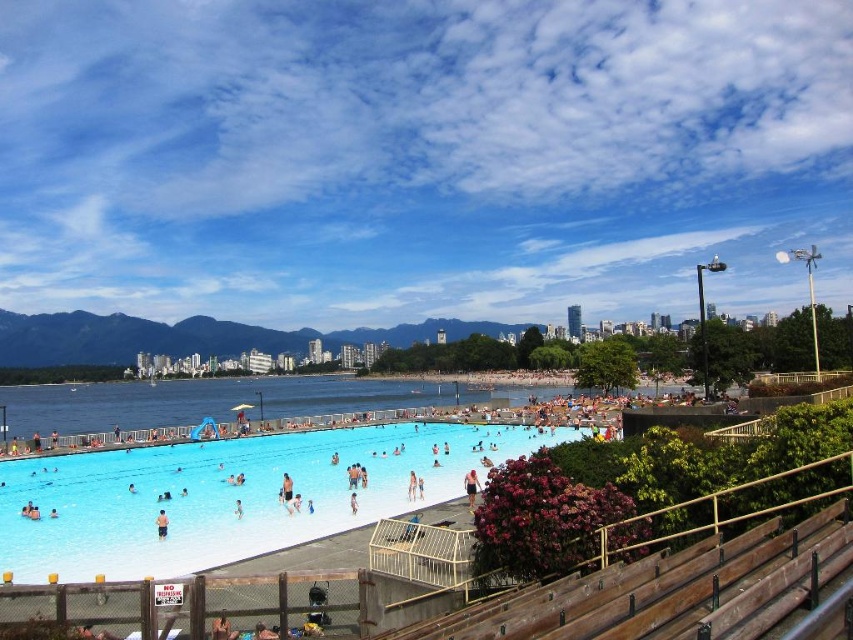
You are a lifeguard on duty at the pool. You notice two items in the scene described. One is the clear plastic pool at lower center and the other is the white cotton shorts at center. Which item takes up more space in the image?

The clear plastic pool at lower center is bigger than the white cotton shorts at center, so it takes up more space in the image.

You are a lifeguard on duty at the public pool area. You notice a swimmer in the clear plastic pool at lower center and another person wearing light blue fabric swim trunks at center. Which object is located to the right of the other?

The clear plastic pool at lower center is positioned on the right side of light blue fabric swim trunks at center, so the clear plastic pool at lower center is to the right of the light blue fabric swim trunks at center.

You are a lifeguard standing at the edge of the clear plastic pool at lower center. You notice someone wearing white cotton shorts at center. Can you see their shorts from your position?

The clear plastic pool at lower center is positioned under white cotton shorts at center, so yes, the lifeguard can see the white cotton shorts at center from their position.